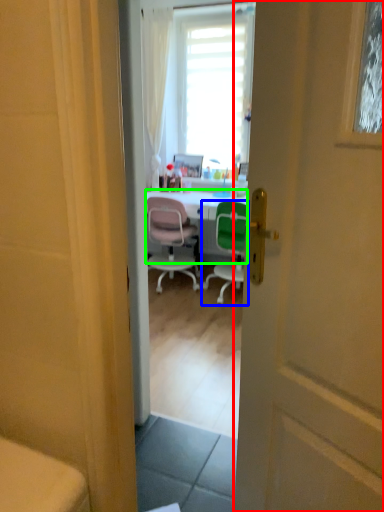
Question: Which object is positioned closest to door (highlighted by a red box)? Select from chair (highlighted by a blue box) and desk (highlighted by a green box).

Choices:
 (A) chair
 (B) desk

Answer: (A)